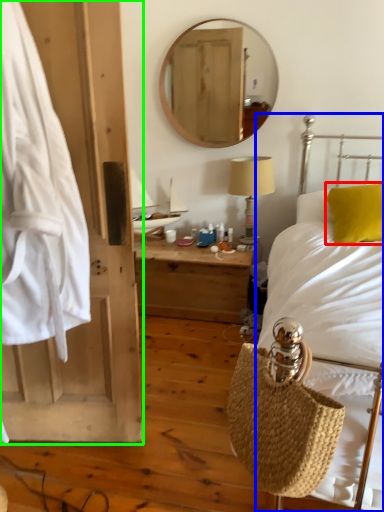
Question: Based on their relative distances, which object is nearer to pillow (highlighted by a red box)? Choose from bed (highlighted by a blue box) and barn door (highlighted by a green box).

Choices:
 (A) bed
 (B) barn door

Answer: (A)